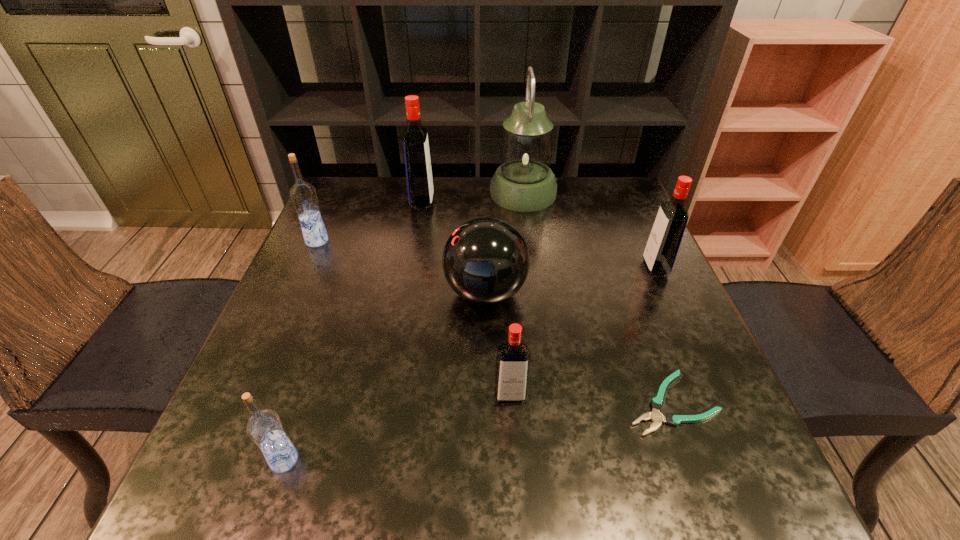
Locate an element on the screen. This screenshot has height=540, width=960. vacant area situated 0.190m on the surface of the black bowling ball near the finger holes is located at coordinates (360, 293).

The image size is (960, 540). I want to click on vacant space situated on the surface of the black bowling ball near the finger holes, so click(x=293, y=293).

At what (x,y) coordinates should I click in order to perform the action: click on free space located on the surface of the black bowling ball near the finger holes. Please return your answer as a coordinate pair (x, y). Looking at the image, I should click on (293, 293).

Locate an element on the screen. This screenshot has height=540, width=960. free space located 0.140m on the front and back of the second red vodka from right to left is located at coordinates (516, 485).

Locate an element on the screen. free region located on the right of the smaller blue vodka is located at coordinates (530, 460).

Locate an element on the screen. Image resolution: width=960 pixels, height=540 pixels. vacant space located 0.140m on the back of the shortest object is located at coordinates click(640, 318).

Where is `lantern that is positioned at the far edge`? The image size is (960, 540). lantern that is positioned at the far edge is located at coordinates (524, 182).

At what (x,y) coordinates should I click in order to perform the action: click on vodka that is at the far edge. Please return your answer as a coordinate pair (x, y). Image resolution: width=960 pixels, height=540 pixels. Looking at the image, I should click on (419, 179).

Locate an element on the screen. object that is at the near edge is located at coordinates (264, 427).

Image resolution: width=960 pixels, height=540 pixels. What are the coordinates of `vodka located in the right edge section of the desktop` in the screenshot? It's located at (665, 238).